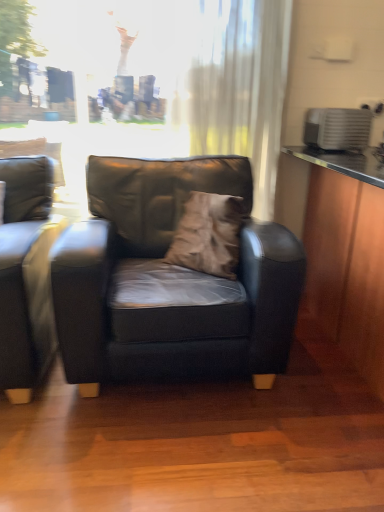
What are the coordinates of `free space in front of matte black chair at center` in the screenshot? It's located at (180, 455).